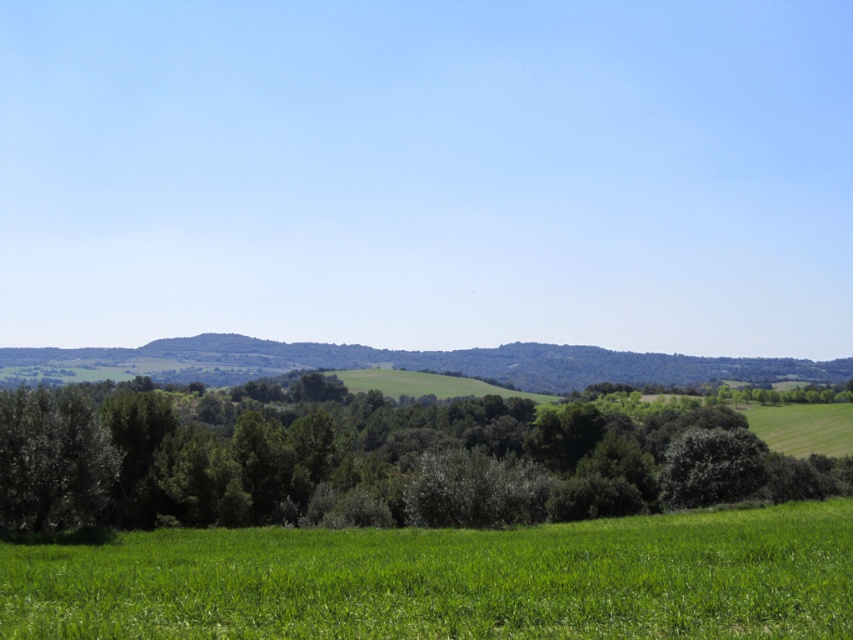
You are standing in the middle of the green field in the image. If you walk straight ahead, will you reach the green leafy trees at center before the point represented by point (376, 460)?

The green leafy trees at center is represented by point (376, 460), so yes, walking straight ahead you will reach the green leafy trees at center at point (376, 460) first.

You are standing in the middle of the green grassy field at lower left and want to walk towards the green leafy trees at center. Which direction should you head?

Since the green leafy trees at center is bigger than the green grassy field at lower left, you should head towards the center where the trees are located.

Consider the image. You are standing in the rural landscape scene and want to walk from point A to point B. Point A is at coordinate point(541, 426) and point B is at coordinate point(653, 586). Which point is closer to you when you start walking?

Point A at coordinate point(541, 426) is closer to you because it is further to the camera than point B at coordinate point(653, 586), meaning it is physically nearer to your current position.